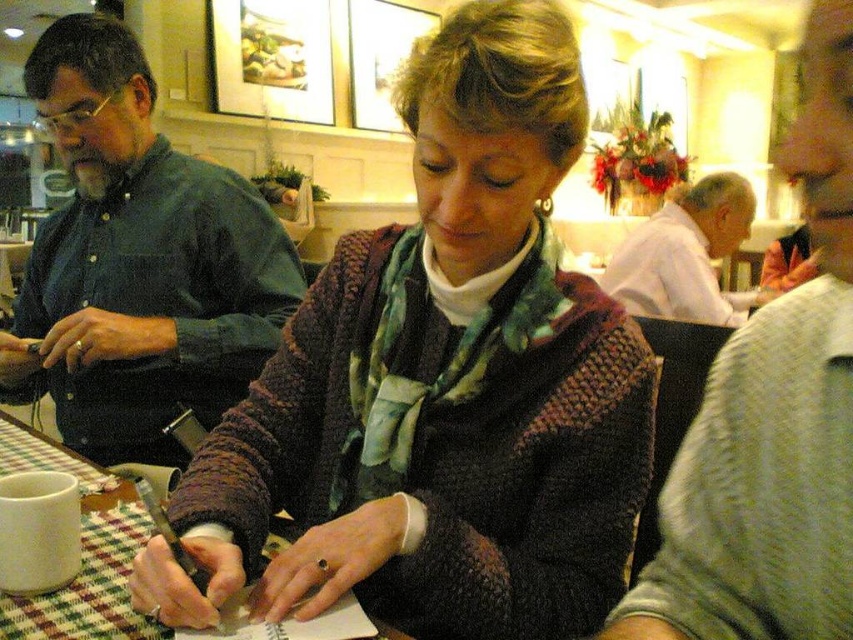
Is point (222, 344) closer to camera compared to point (618, 282)?

Yes, it is in front of point (618, 282).

Which is behind, point (154, 332) or point (664, 232)?

The point (664, 232) is more distant.

This screenshot has height=640, width=853. Identify the location of green matte shirt at left. (138, 262).

Does knitted sweater at center appear over green matte shirt at left?

Actually, knitted sweater at center is below green matte shirt at left.

Is point (608, 524) farther from camera compared to point (148, 355)?

No.

The width and height of the screenshot is (853, 640). I want to click on knitted sweater at center, so click(x=439, y=385).

What do you see at coordinates (439, 385) in the screenshot? I see `knitted sweater at center` at bounding box center [439, 385].

Between knitted sweater at center and white cotton shirt at upper right, which one has more height?

knitted sweater at center

Where is `knitted sweater at center`? The height and width of the screenshot is (640, 853). knitted sweater at center is located at coordinates (439, 385).

At what (x,y) coordinates should I click in order to perform the action: click on knitted sweater at center. Please return your answer as a coordinate pair (x, y). The height and width of the screenshot is (640, 853). Looking at the image, I should click on (439, 385).